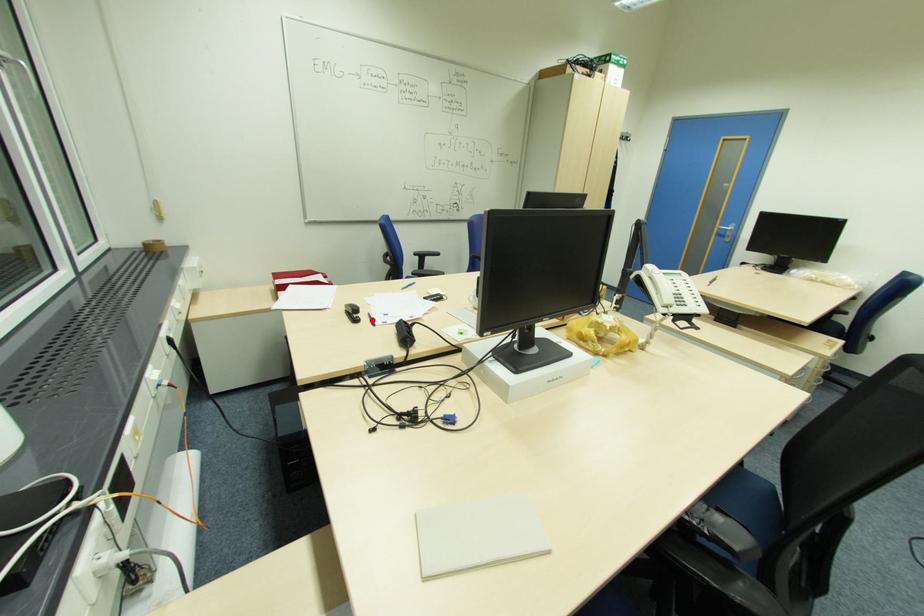
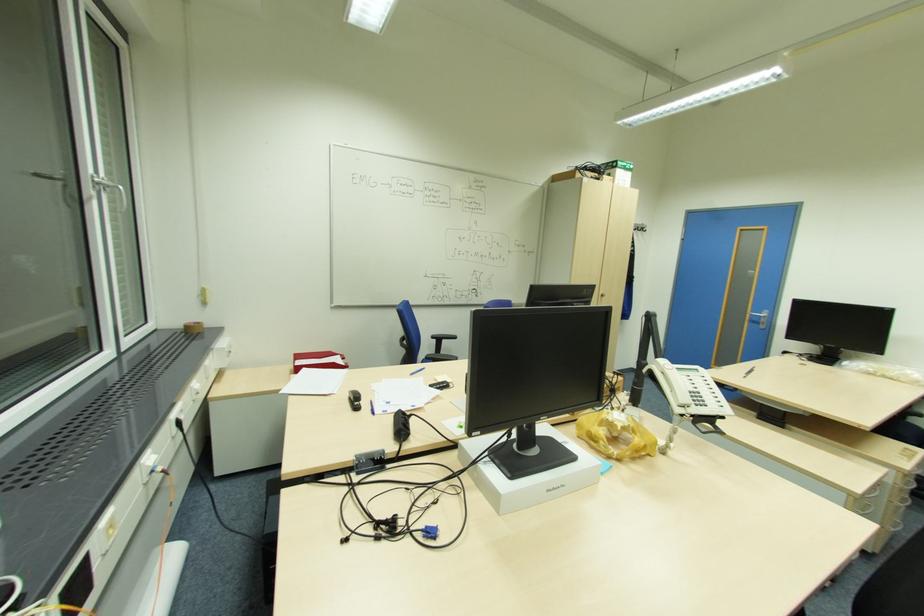
The point at the highlighted location is marked in the first image. Where is the corresponding point in the second image?

(372, 408)